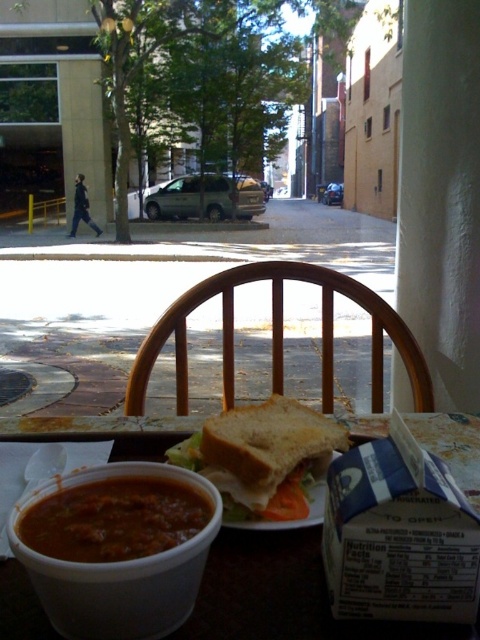
You are standing at the origin point of the image coordinate system. The origin is at the bottom left corner of the image. You want to walk to the wooden chair at center. In which direction should you move relative to your current position?

Since the wooden chair at center is located at point (278,336) in the 2D coordinate system, you should move northeast to reach it from the origin at the bottom left corner.

You are a waiter carrying a tray of dishes to the kitchen. You see the brown matte bowl at lower left and the white bread sandwich at center. Which item is located below the other?

The brown matte bowl at lower left is positioned under the white bread sandwich at center, so the bowl is below the sandwich.

You are a customer at the outdoor dining area and want to reach for the thick tomato soup at lower left without disturbing the brown matte bowl at lower left. Is it possible to do so?

The brown matte bowl at lower left is closer to the viewer than the thick tomato soup at lower left, so you can reach the thick tomato soup at lower left without moving the brown matte bowl at lower left as it is behind it.